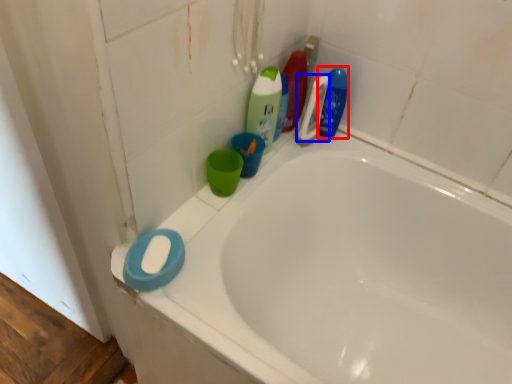
Question: Which of the following is the farthest to the observer, cleaning product (highlighted by a red box) or cleaning product (highlighted by a blue box)?

Choices:
 (A) cleaning product
 (B) cleaning product

Answer: (A)